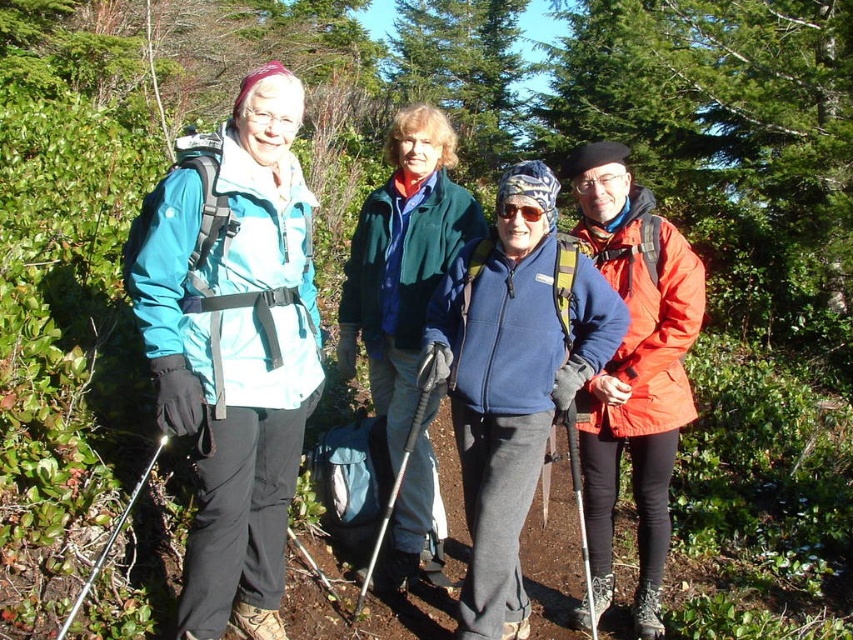
You are a photographer standing at the center of the hiking trail. You want to take a photo that includes both the teal matte jacket at left and the matte orange jacket at right. Which jacket should you position closer to the bottom of the frame to ensure both are fully visible?

The teal matte jacket at left is located above the matte orange jacket at right. To ensure both are fully visible in the photo, position the matte orange jacket at right closer to the bottom of the frame since it is lower in the scene.

You are planning to buy a jacket for a hiking trip and want to know which one would provide more warmth based on their sizes. Which jacket, the teal matte jacket at left or the green fleece jacket at center, is bigger?

The teal matte jacket at left is larger in size than the green fleece jacket at center, so it would likely provide more warmth due to its larger size.

You are a photographer trying to capture a group photo of the teal matte jacket at left and the matte orange jacket at right. Since you want to ensure both are in the frame, which direction should you position yourself relative to the group?

You should position yourself to the right of the group so that both the teal matte jacket at left and the matte orange jacket at right are visible in the frame.